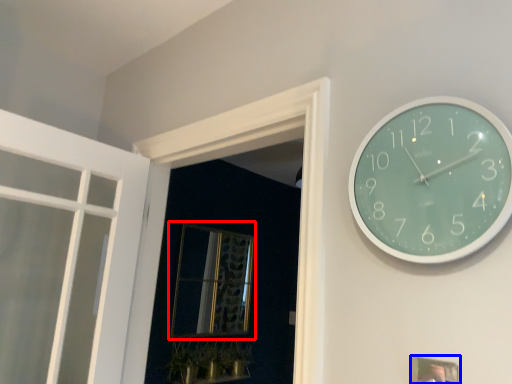
Question: Which point is closer to the camera, window (highlighted by a red box) or picture frame (highlighted by a blue box)?

Choices:
 (A) window
 (B) picture frame

Answer: (B)